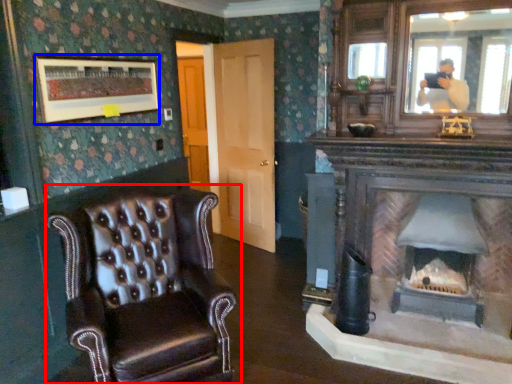
Question: Which of the following is the farthest to the observer, chair (highlighted by a red box) or picture frame (highlighted by a blue box)?

Choices:
 (A) chair
 (B) picture frame

Answer: (B)